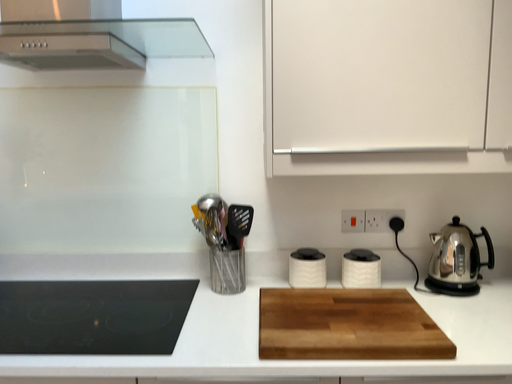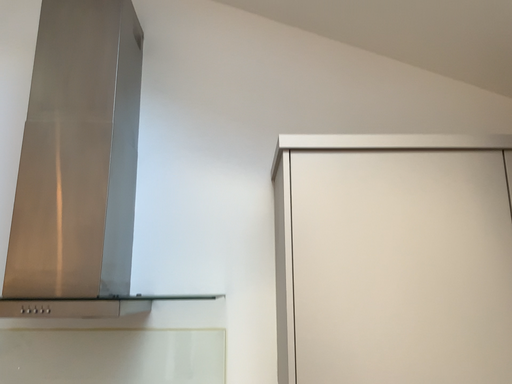
Question: How did the camera likely rotate when shooting the video?

Choices:
 (A) rotated downward
 (B) rotated upward

Answer: (B)